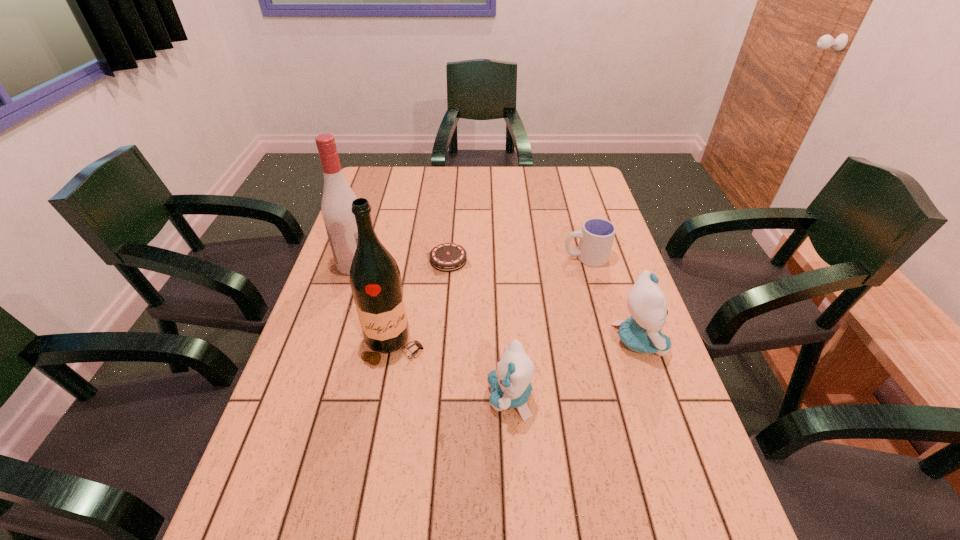
Please point a spot to add another kitten on the left. Please provide its 2D coordinates. Your answer should be formatted as a tuple, i.e. [(x, y)], where the tuple contains the x and y coordinates of a point satisfying the conditions above.

[(345, 470)]